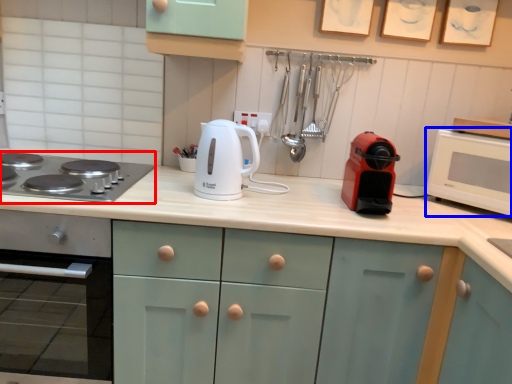
Question: Which of the following is the closest to the observer, gas stove (highlighted by a red box) or microwave oven (highlighted by a blue box)?

Choices:
 (A) gas stove
 (B) microwave oven

Answer: (A)